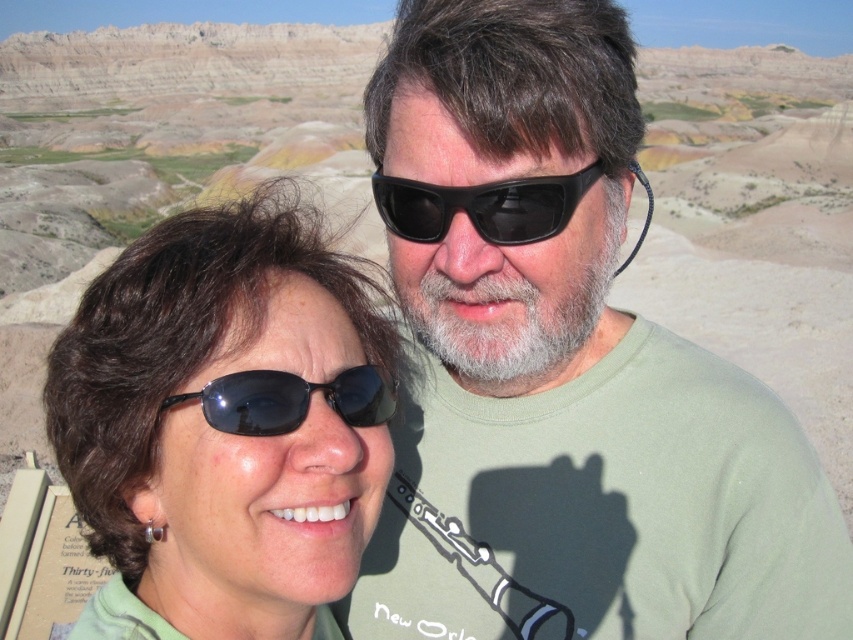
Question: Considering the real-world distances, which object is closest to the black reflective sunglasses at center?

Choices:
 (A) matte green t-shirt at center
 (B) matte black sunglasses at left

Answer: (B)

Question: Estimate the real-world distances between objects in this image. Which object is closer to the matte green t-shirt at center?

Choices:
 (A) black matte sunglasses at center
 (B) black reflective sunglasses at center
 (C) matte black sunglasses at left

Answer: (A)

Question: Can you confirm if matte green t-shirt at center is smaller than black reflective sunglasses at center?

Choices:
 (A) no
 (B) yes

Answer: (A)

Question: Which object appears farthest from the camera in this image?

Choices:
 (A) matte green t-shirt at center
 (B) black reflective sunglasses at center
 (C) matte black sunglasses at left
 (D) black matte sunglasses at center

Answer: (D)

Question: Is matte black sunglasses at left positioned behind black reflective sunglasses at center?

Choices:
 (A) no
 (B) yes

Answer: (A)

Question: Considering the relative positions of black matte sunglasses at center and black reflective sunglasses at center in the image provided, where is black matte sunglasses at center located with respect to black reflective sunglasses at center?

Choices:
 (A) left
 (B) right

Answer: (B)